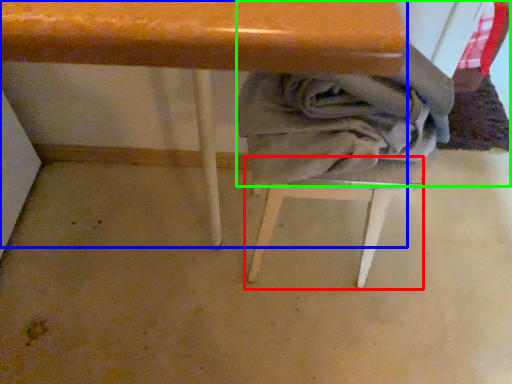
Question: Which object is positioned farthest from step stool (highlighted by a red box)? Select from table (highlighted by a blue box) and laundry (highlighted by a green box).

Choices:
 (A) table
 (B) laundry

Answer: (A)